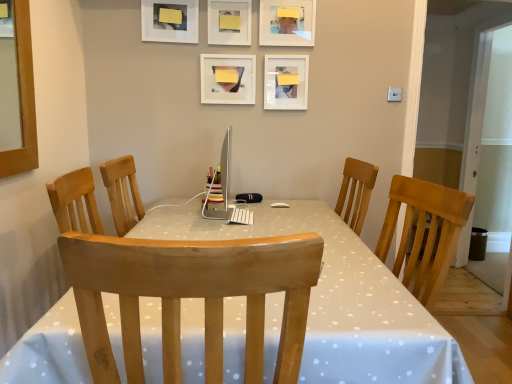
Question: Which direction should I rotate to look at white matte picture frame at upper center, the 3th picture frame from the left, — up or down?

Choices:
 (A) up
 (B) down

Answer: (A)

Question: Could you tell me if white matte picture frame at upper center, placed as the 3th picture frame when sorted from right to left, is facing white matte picture frame at upper center, acting as the fourth picture frame starting from the left?

Choices:
 (A) yes
 (B) no

Answer: (B)

Question: From the image's perspective, is white matte picture frame at upper center, placed as the 3th picture frame when sorted from right to left, beneath white matte picture frame at upper center, acting as the fourth picture frame starting from the left?

Choices:
 (A) yes
 (B) no

Answer: (B)

Question: Can you confirm if white matte picture frame at upper center, the 3th picture frame from the left, is wider than white matte picture frame at upper center, acting as the fourth picture frame starting from the left?

Choices:
 (A) no
 (B) yes

Answer: (A)

Question: Can you confirm if white matte picture frame at upper center, placed as the 3th picture frame when sorted from right to left, is positioned to the right of white matte picture frame at upper center, the 2th picture frame viewed from the right?

Choices:
 (A) yes
 (B) no

Answer: (B)

Question: Is white matte picture frame at upper center, placed as the 3th picture frame when sorted from right to left, to the left of white matte picture frame at upper center, acting as the fourth picture frame starting from the left, from the viewer's perspective?

Choices:
 (A) no
 (B) yes

Answer: (B)

Question: Is white matte picture frame at upper center, placed as the 3th picture frame when sorted from right to left, smaller than white matte picture frame at upper center, acting as the fourth picture frame starting from the left?

Choices:
 (A) no
 (B) yes

Answer: (B)

Question: Does matte plastic picture frame at upper center, positioned as the 2th picture frame in left-to-right order, come in front of light wood chair at center?

Choices:
 (A) no
 (B) yes

Answer: (A)

Question: Is matte plastic picture frame at upper center, which is the fourth picture frame in right-to-left order, positioned beyond the bounds of light wood chair at center?

Choices:
 (A) no
 (B) yes

Answer: (B)

Question: From a real-world perspective, is matte plastic picture frame at upper center, which is the fourth picture frame in right-to-left order, beneath light wood chair at center?

Choices:
 (A) no
 (B) yes

Answer: (A)

Question: Does matte plastic picture frame at upper center, which is the fourth picture frame in right-to-left order, have a lesser width compared to light wood chair at center?

Choices:
 (A) yes
 (B) no

Answer: (A)

Question: From the image's perspective, is matte plastic picture frame at upper center, positioned as the 2th picture frame in left-to-right order, above light wood chair at center?

Choices:
 (A) no
 (B) yes

Answer: (B)

Question: Is matte plastic picture frame at upper center, which is the fourth picture frame in right-to-left order, smaller than light wood chair at center?

Choices:
 (A) yes
 (B) no

Answer: (A)

Question: From a real-world perspective, is white matte picture frame at upper center, the 2th picture frame viewed from the right, positioned under matte plastic picture frame at upper center, positioned as the 2th picture frame in left-to-right order, based on gravity?

Choices:
 (A) yes
 (B) no

Answer: (A)